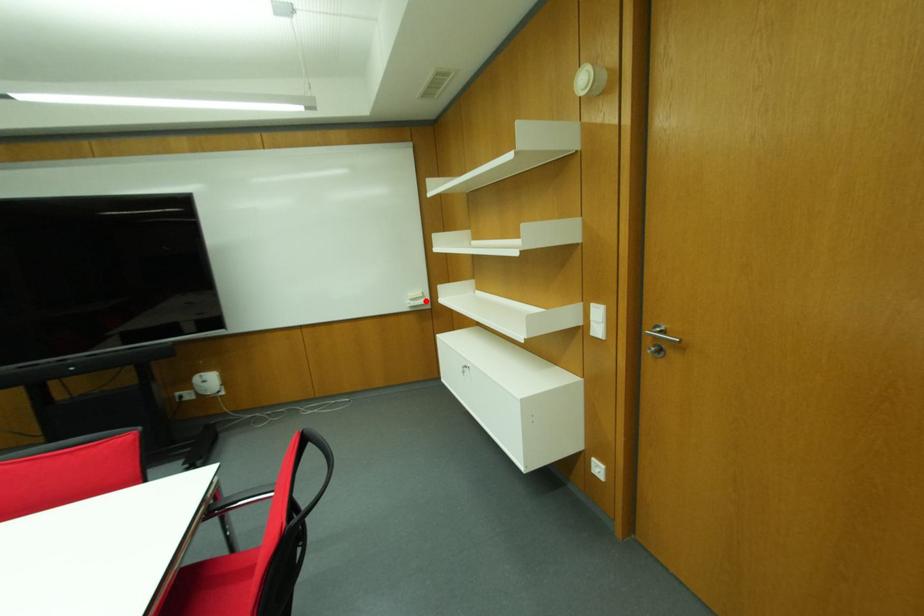
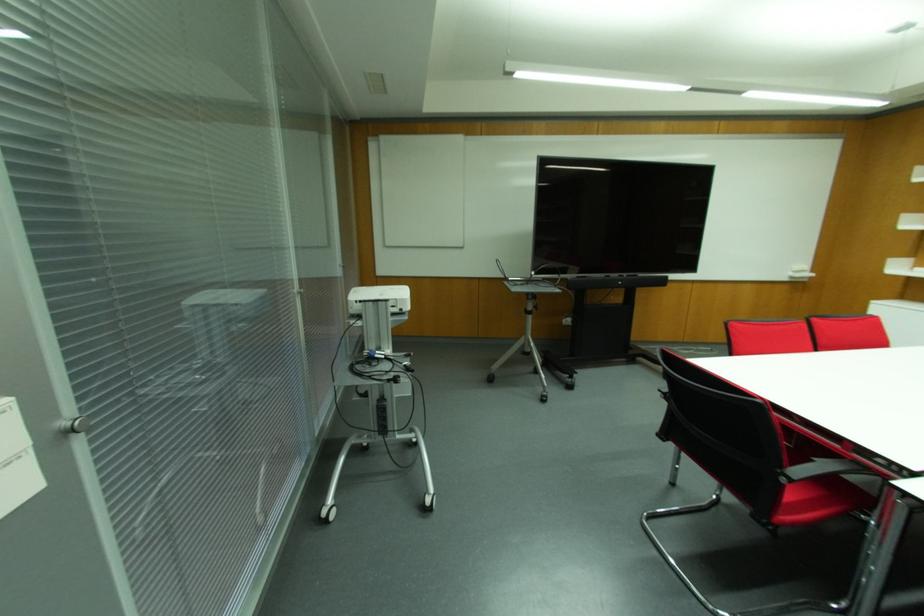
Question: I am providing you with two images of the same scene from different viewpoints. In image1, a red point is highlighted. Considering the same 3D point in image2, which of the following is correct?

Choices:
 (A) It is closer
 (B) It is farther

Answer: (B)